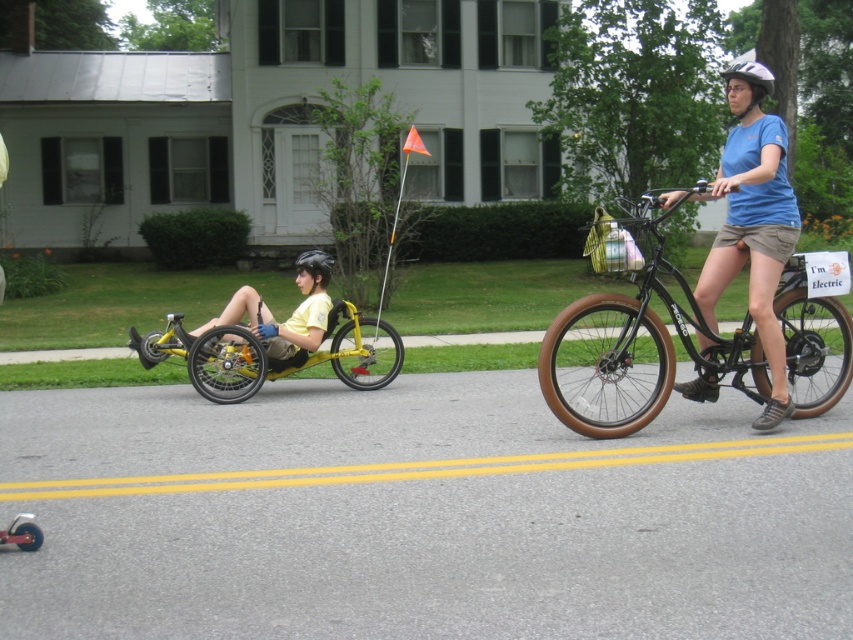
You are a pedestrian standing at the crosswalk and see both the white matte bicycle helmet at upper center and the black matte helmet at center. Which helmet is positioned to the right side from your perspective?

The white matte bicycle helmet at upper center is positioned to the right of the black matte helmet at center.

You are a delivery person who needs to place a small package between the brown rubber bicycle at right and the white matte bicycle helmet at upper center. The package is 3 feet long. Can you fit it between them without moving either object?

The distance between the brown rubber bicycle at right and the white matte bicycle helmet at upper center is 7.23 feet. Since the package is 3 feet long, it can easily fit within the available space.

You are standing in front of the image and want to touch the two points marked in the scene. Which point, point (x=764, y=72) or point (x=317, y=250), is closer to your hand when you reach out?

Point (x=764, y=72) is closer to the viewer than point (x=317, y=250), so it will be closer to your hand when you reach out.